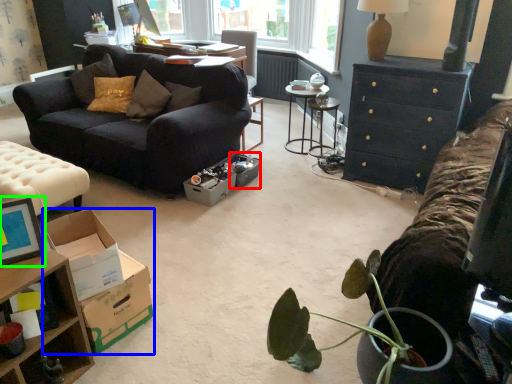
Question: Estimate the real-world distances between objects in this image. Which object is farther from box (highlighted by a red box), cardboard box (highlighted by a blue box) or picture frame (highlighted by a green box)?

Choices:
 (A) cardboard box
 (B) picture frame

Answer: (B)